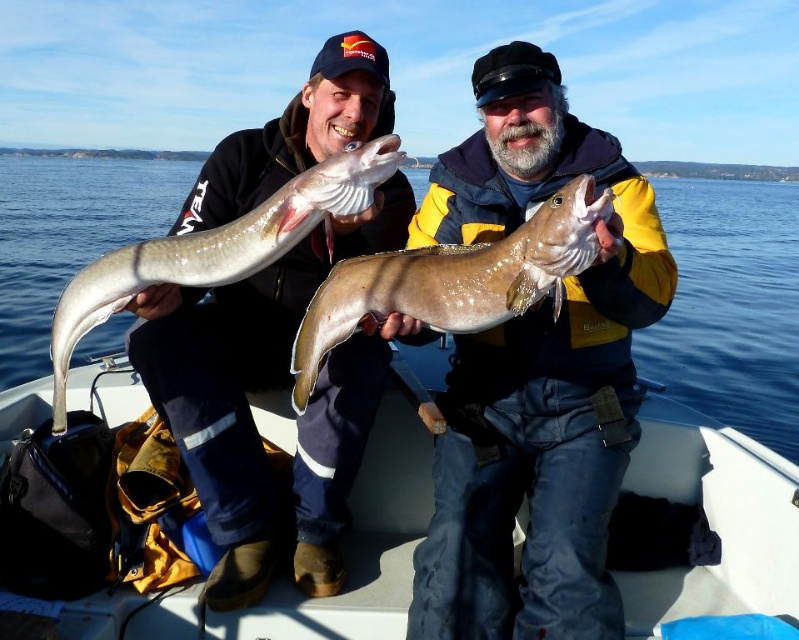
Who is positioned more to the left, smooth brown fish at center or sleek silver fish at center?

From the viewer's perspective, sleek silver fish at center appears more on the left side.

Can you confirm if smooth brown fish at center is positioned below sleek silver fish at center?

Correct, smooth brown fish at center is located below sleek silver fish at center.

Does point (330, 330) come in front of point (384, 147)?

No.

Where is `smooth brown fish at center`? Image resolution: width=799 pixels, height=640 pixels. smooth brown fish at center is located at coordinates (454, 280).

Can you confirm if shiny silver fish at center is bigger than sleek silver fish at center?

Yes, shiny silver fish at center is bigger than sleek silver fish at center.

Can you confirm if shiny silver fish at center is taller than sleek silver fish at center?

Correct, shiny silver fish at center is much taller as sleek silver fish at center.

Image resolution: width=799 pixels, height=640 pixels. Describe the element at coordinates (535, 376) in the screenshot. I see `shiny silver fish at center` at that location.

In order to click on shiny silver fish at center in this screenshot , I will do `click(535, 376)`.

How far apart are shiny silver fish at center and smooth brown fish at center?

shiny silver fish at center and smooth brown fish at center are 14.04 inches apart.

Does shiny silver fish at center have a greater width compared to smooth brown fish at center?

Indeed, shiny silver fish at center has a greater width compared to smooth brown fish at center.

Measure the distance between shiny silver fish at center and camera.

shiny silver fish at center is 1.30 meters from camera.

Locate an element on the screen. The image size is (799, 640). shiny silver fish at center is located at coordinates (535, 376).